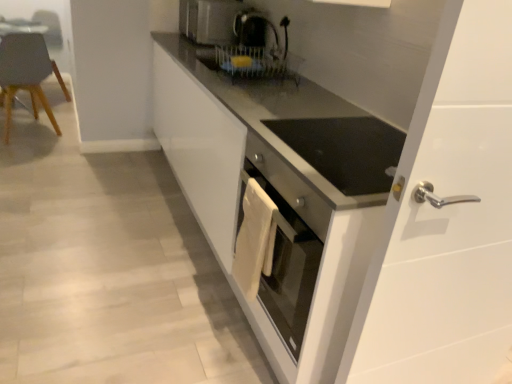
Question: Which is correct: white glossy cabinet at center is inside matte gray chair at left, or outside of it?

Choices:
 (A) inside
 (B) outside

Answer: (B)

Question: Considering the positions of white glossy cabinet at center and matte gray chair at left in the image, is white glossy cabinet at center bigger or smaller than matte gray chair at left?

Choices:
 (A) big
 (B) small

Answer: (A)

Question: Which of these objects is positioned closest to the white glossy door handle at right?

Choices:
 (A) satin silver toaster at upper center
 (B) black glossy coffee machine at upper center
 (C) white glossy cabinet at center
 (D) matte gray chair at left

Answer: (C)

Question: Estimate the real-world distances between objects in this image. Which object is closer to the white glossy door handle at right?

Choices:
 (A) black glossy coffee machine at upper center
 (B) white glossy cabinet at center
 (C) matte gray chair at left
 (D) satin silver toaster at upper center

Answer: (B)